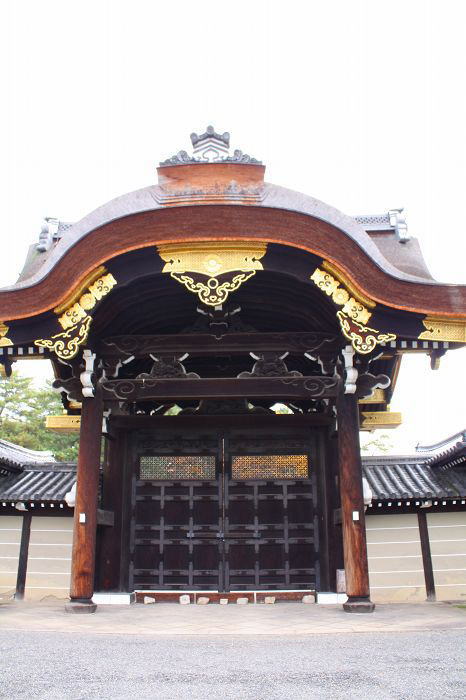
Locate an element on the screen. wall is located at coordinates (394, 570), (445, 536), (59, 549), (3, 545).